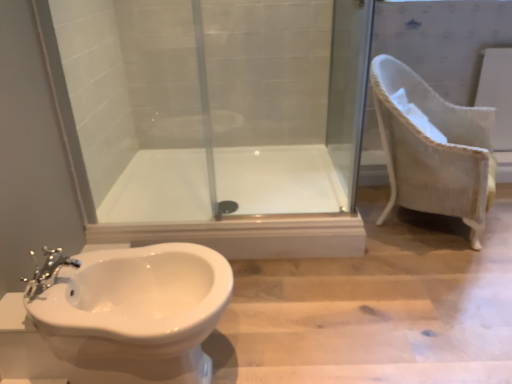
Where is `free space to the left of transparent glass screen door at center`? free space to the left of transparent glass screen door at center is located at coordinates (271, 176).